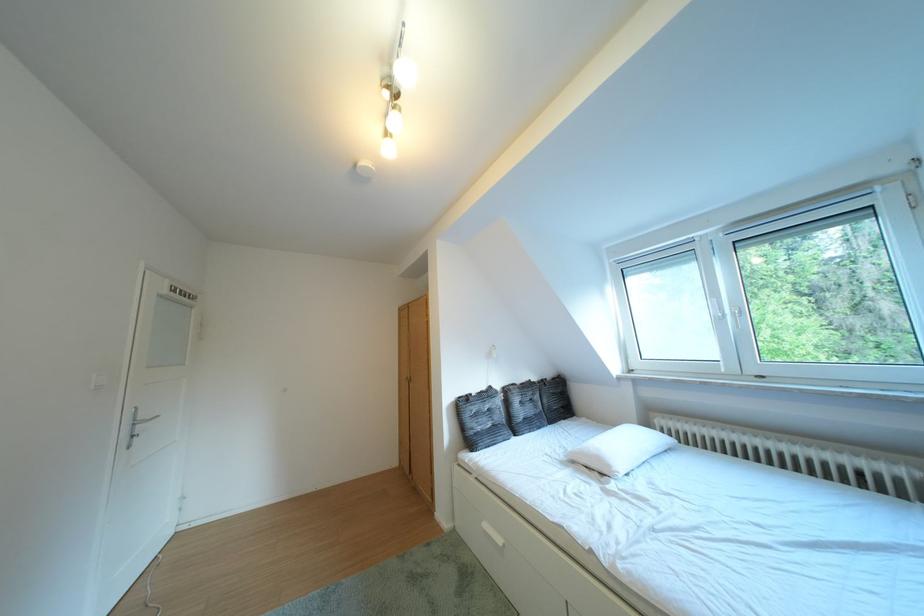
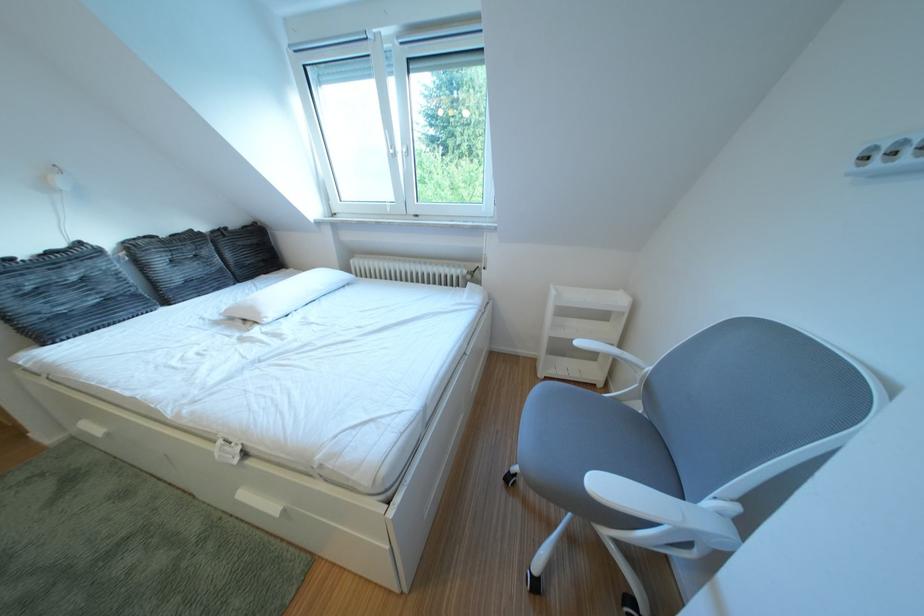
How did the camera likely rotate?

The camera rotated toward right-down.